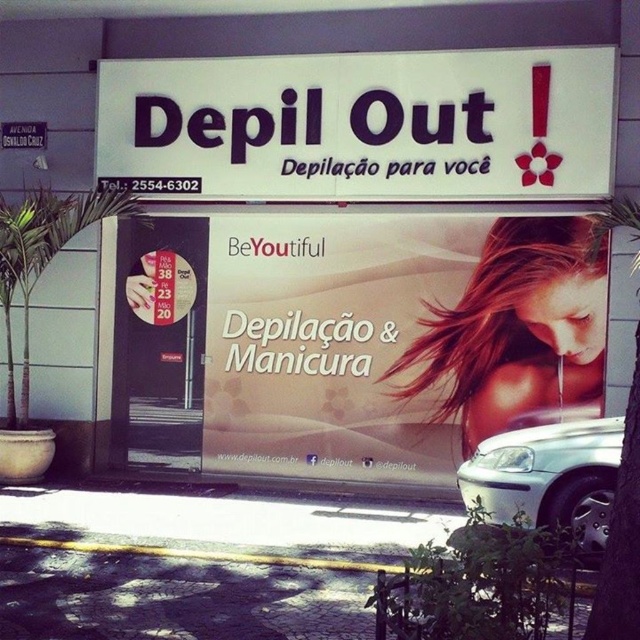
Question: Considering the real-world distances, which object is farthest from the white plastic sign at upper center?

Choices:
 (A) blonde hair at center
 (B) matte white banner at center

Answer: (A)

Question: Is white plastic sign at upper center positioned in front of silver metallic car at lower right?

Choices:
 (A) no
 (B) yes

Answer: (A)

Question: Which object is positioned farthest from the white plastic sign at upper center?

Choices:
 (A) silver metallic car at lower right
 (B) blonde hair at center

Answer: (A)

Question: Which object appears closest to the camera in this image?

Choices:
 (A) silver metallic car at lower right
 (B) matte white banner at center
 (C) white plastic sign at upper center

Answer: (A)

Question: From the image, what is the correct spatial relationship of blonde hair at center in relation to silver metallic car at lower right?

Choices:
 (A) left
 (B) right

Answer: (B)

Question: Is white plastic sign at upper center above blonde hair at center?

Choices:
 (A) yes
 (B) no

Answer: (A)